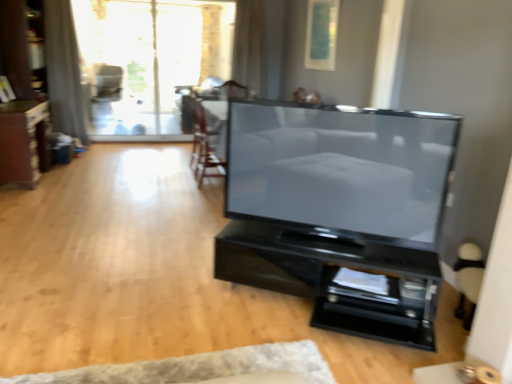
Identify the location of blank space to the left of white textured rug at lower center. (68, 332).